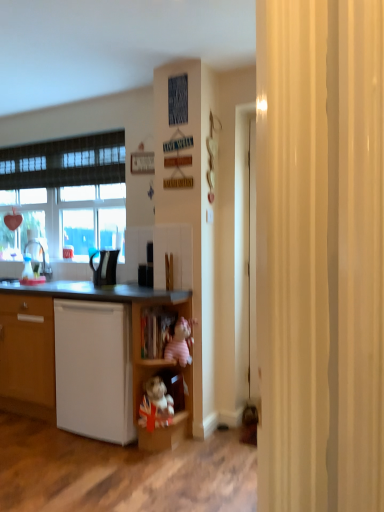
At what (x,y) coordinates should I click in order to perform the action: click on vacant area that lies in front of wooden shelf at center. Please return your answer as a coordinate pair (x, y). The image size is (384, 512). Looking at the image, I should click on (161, 465).